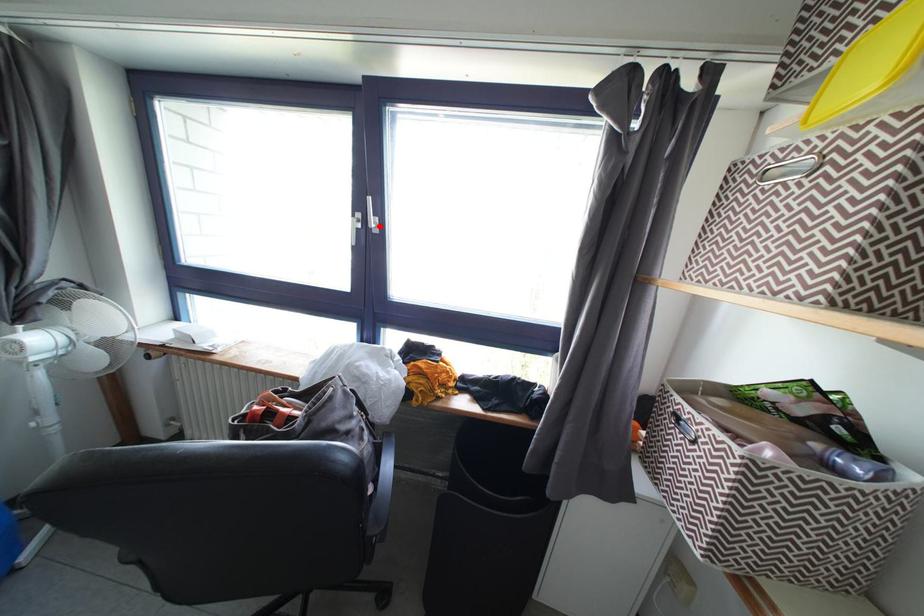
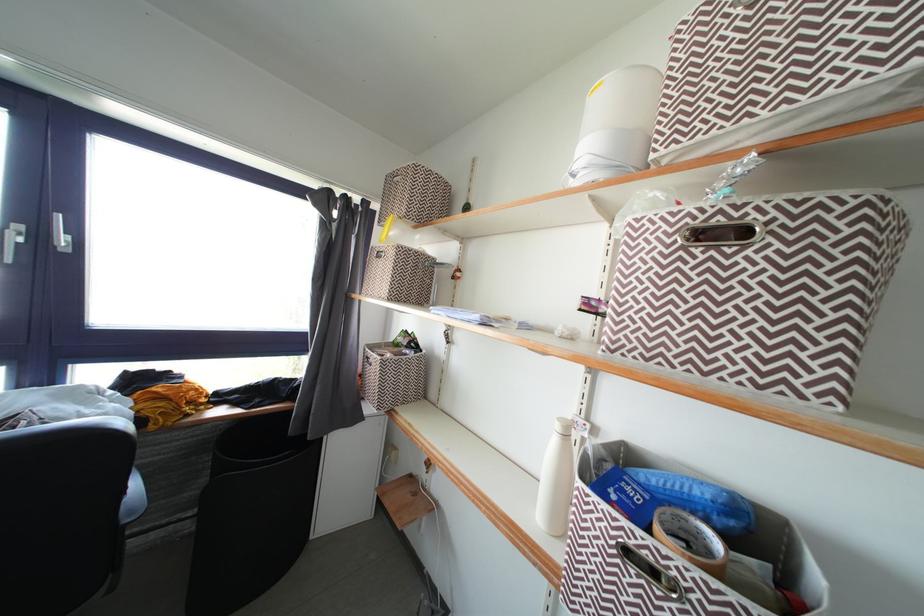
Locate, in the second image, the point that corresponds to the highlighted location in the first image.

(70, 245)